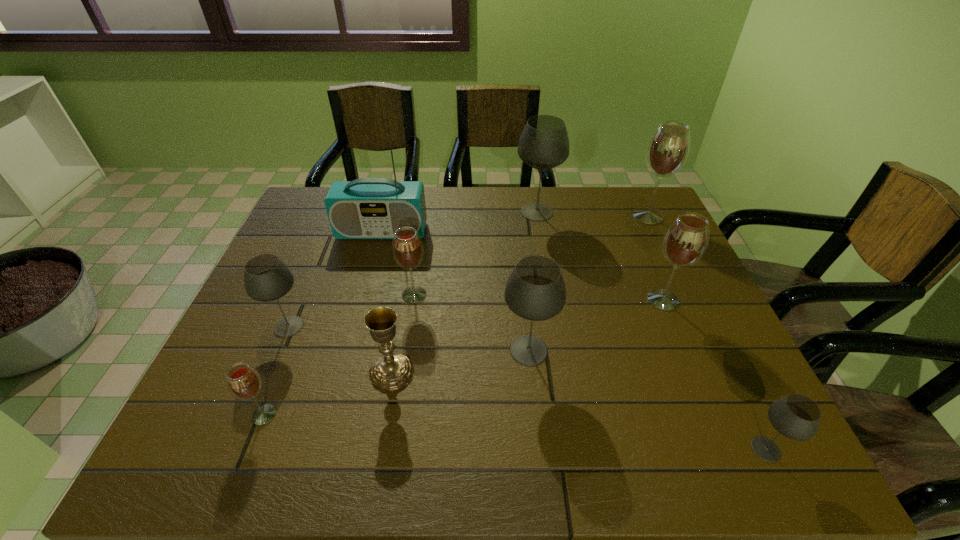
Identify the location of vacant region at the far edge of the desktop. (536, 191).

Identify the location of blank space at the near edge of the desktop. (595, 442).

You are a GUI agent. You are given a task and a screenshot of the screen. Output one action in this format:
    pyautogui.click(x=<x>, y=<y>)
    Task: Click on the vacant space at the left edge of the desktop
    The height and width of the screenshot is (540, 960).
    Given the screenshot: What is the action you would take?
    pyautogui.click(x=311, y=245)

The height and width of the screenshot is (540, 960). I want to click on vacant position at the right edge of the desktop, so click(643, 249).

In the image, there is a desktop. Where is `blank space at the far left corner`? blank space at the far left corner is located at coordinates (303, 207).

Where is `blank region between the farthest red wineglass and the leftmost gray wineglass`? blank region between the farthest red wineglass and the leftmost gray wineglass is located at coordinates (468, 271).

The width and height of the screenshot is (960, 540). I want to click on free space between the farthest gray wineglass and the second biggest red wineglass, so click(x=600, y=256).

Find the location of a particular element. This screenshot has height=540, width=960. vacant space in between the second biggest gray wineglass and the second smallest red wineglass is located at coordinates (471, 322).

Where is `vacant space that is in between the light radio receiver and the biggest gray wineglass`? vacant space that is in between the light radio receiver and the biggest gray wineglass is located at coordinates (460, 222).

Identify the location of free area in between the third smallest gray wineglass and the nearest gray wineglass. The image size is (960, 540). (647, 400).